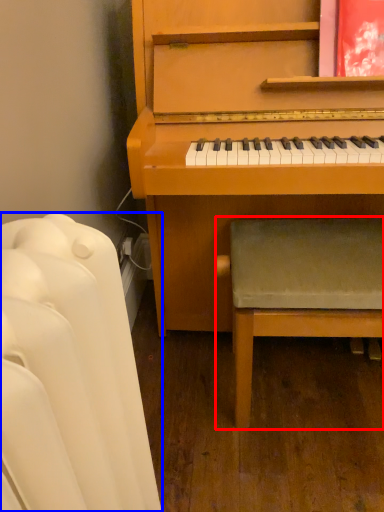
Question: Which object appears closest to the camera in this image, armchair (highlighted by a red box) or furniture (highlighted by a blue box)?

Choices:
 (A) armchair
 (B) furniture

Answer: (B)